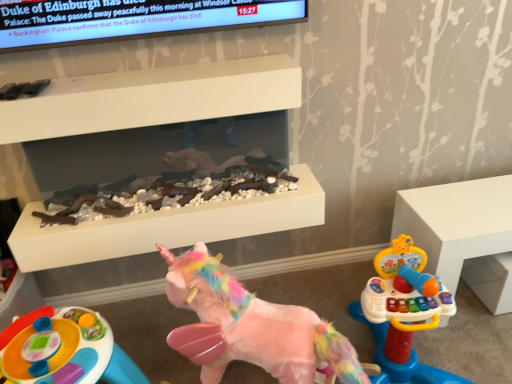
Where is `vacant space in white matte fireplace at upper center (from a real-world perspective)`? This screenshot has height=384, width=512. vacant space in white matte fireplace at upper center (from a real-world perspective) is located at coordinates 190,315.